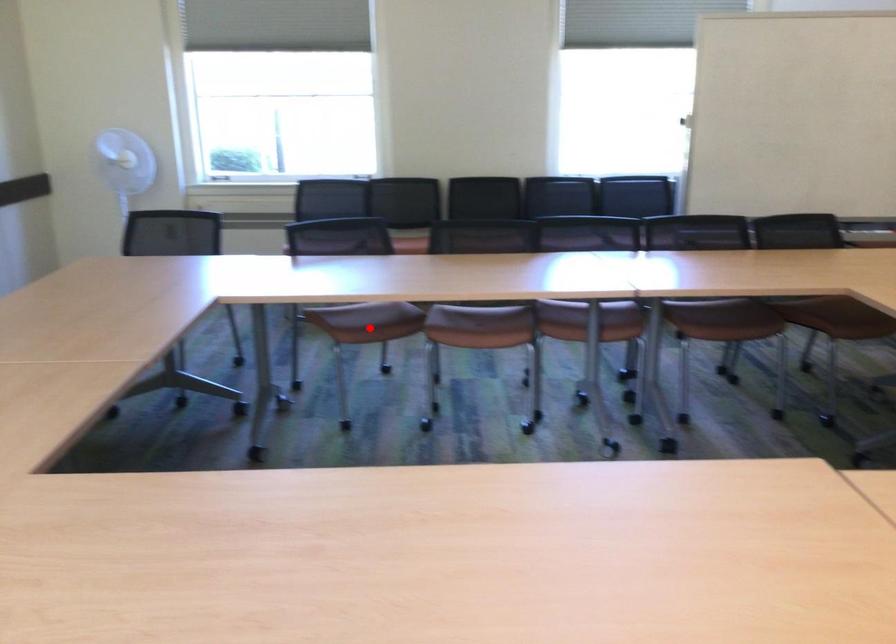
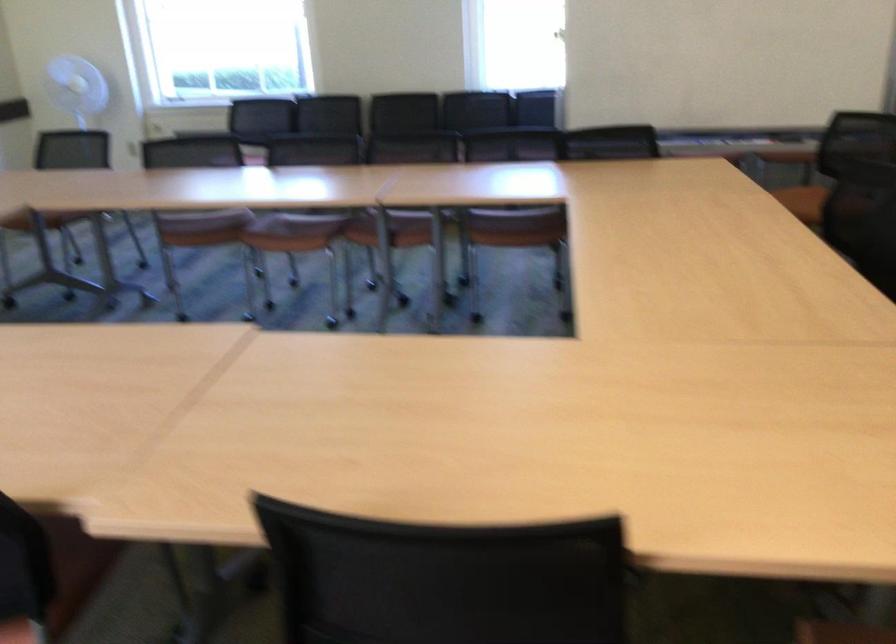
Where in the second image is the point corresponding to the highlighted location from the first image?

(199, 227)